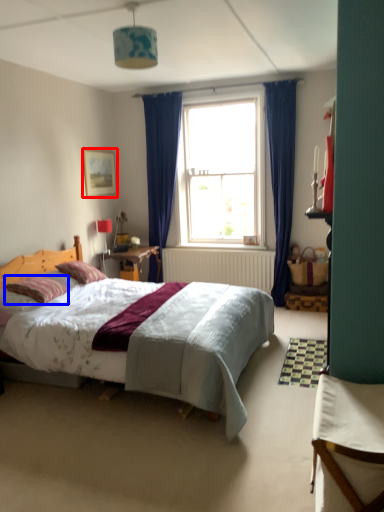
Question: Which point is further to the camera, picture frame (highlighted by a red box) or pillow (highlighted by a blue box)?

Choices:
 (A) picture frame
 (B) pillow

Answer: (A)